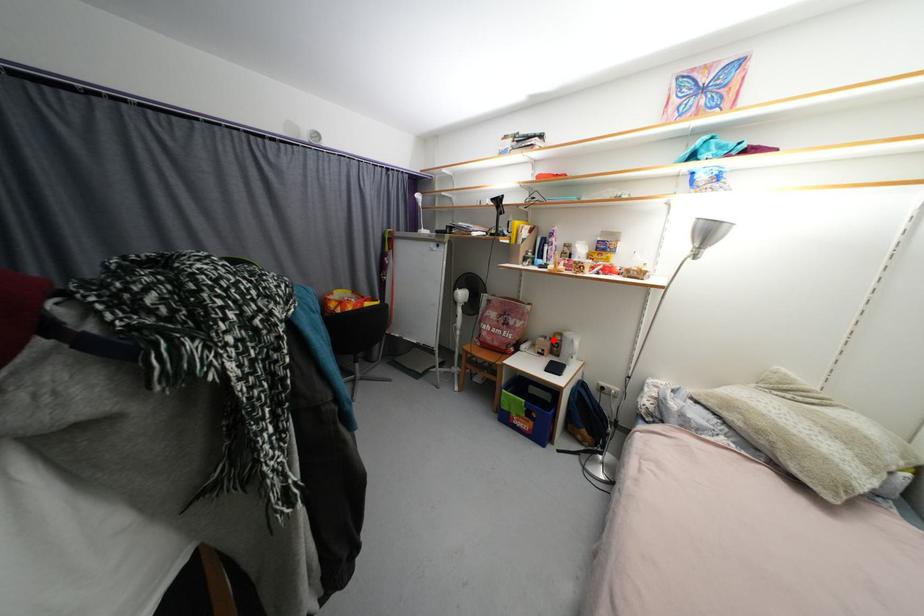
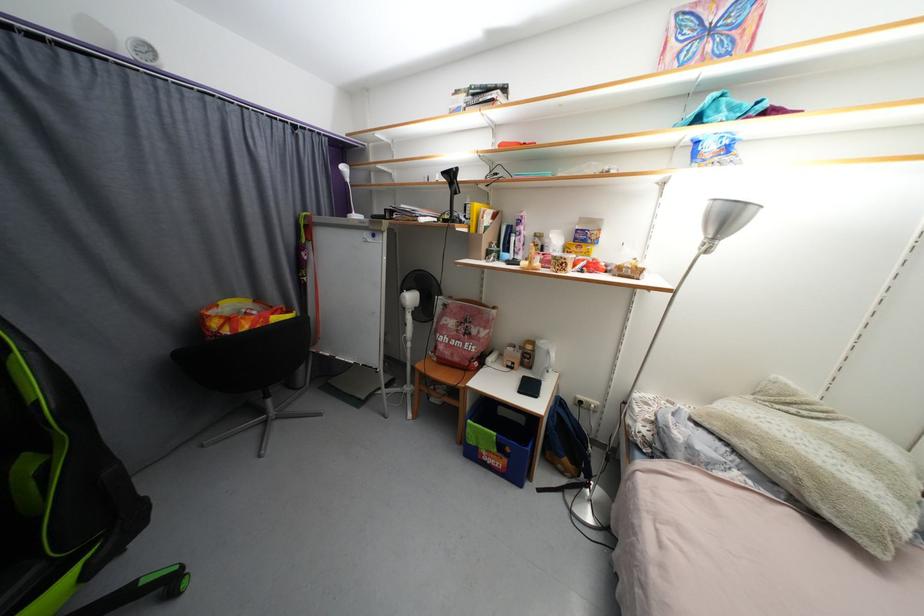
Find the pixel in the second image that matches the highlighted location in the first image.

(523, 349)